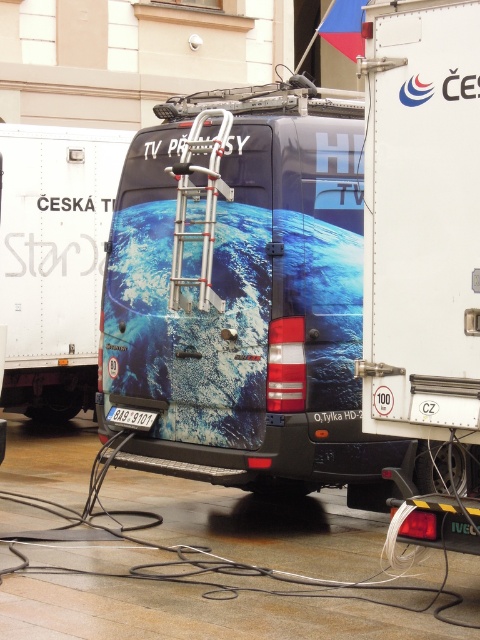
Question: Which point is closer to the camera?

Choices:
 (A) metallic blue van at center
 (B) aluminum ladder at center
 (C) white matte truck at right

Answer: (C)

Question: From the image, what is the correct spatial relationship of white matte truck at right in relation to metallic blue van at center?

Choices:
 (A) right
 (B) left

Answer: (A)

Question: Is white matte truck at right below metallic blue van at center?

Choices:
 (A) yes
 (B) no

Answer: (A)

Question: Which object is farther from the camera taking this photo?

Choices:
 (A) metallic blue van at center
 (B) white matte truck at right
 (C) aluminum ladder at center

Answer: (A)

Question: Is metallic silver ladder at center to the left of aluminum ladder at center from the viewer's perspective?

Choices:
 (A) no
 (B) yes

Answer: (A)

Question: Among these points, which one is nearest to the camera?

Choices:
 (A) 177,164
 (B) 155,140
 (C) 440,96
 (D) 45,358

Answer: (C)